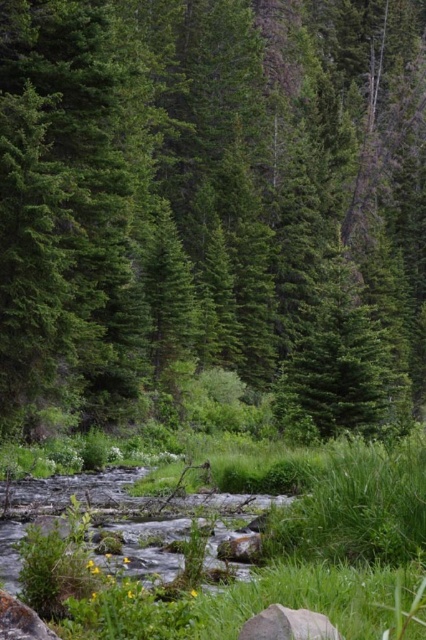
You are standing at the point closer to the camera in the forest scene. Which point are you at, point [48,310] or point [97,612]?

You are at point [48,310] because it is further to the camera than point [97,612].

You are a hiker trying to cross the stream in the forest. You see the green grass at center and the gray matte rock at lower center. Which object is larger in size?

The green grass at center is bigger than the gray matte rock at lower center, so the green grass at center is larger in size.

You are a hiker standing at the edge of the forest. You notice a green matte tree at center and green grass at center. Which object is higher in the scene?

The green matte tree at center is above the green grass at center, so the green matte tree at center is higher in the scene.